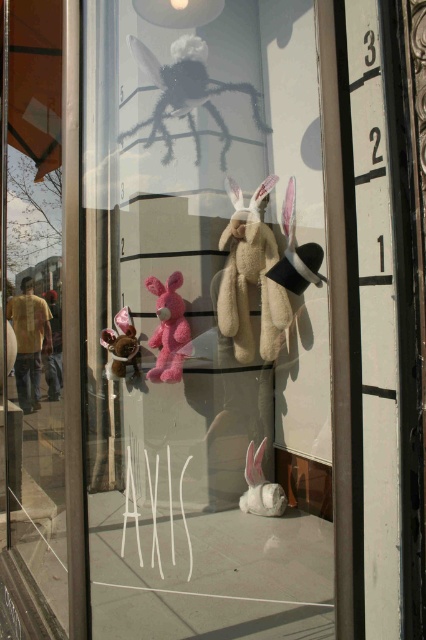
You are a customer looking at the storefront window display. You notice two rabbits in the window. The beige plush rabbit at center and the white plush rabbit at lower center. Which rabbit appears closer to you based on their positions?

The beige plush rabbit at center appears closer to you because the white plush rabbit at lower center is behind it.